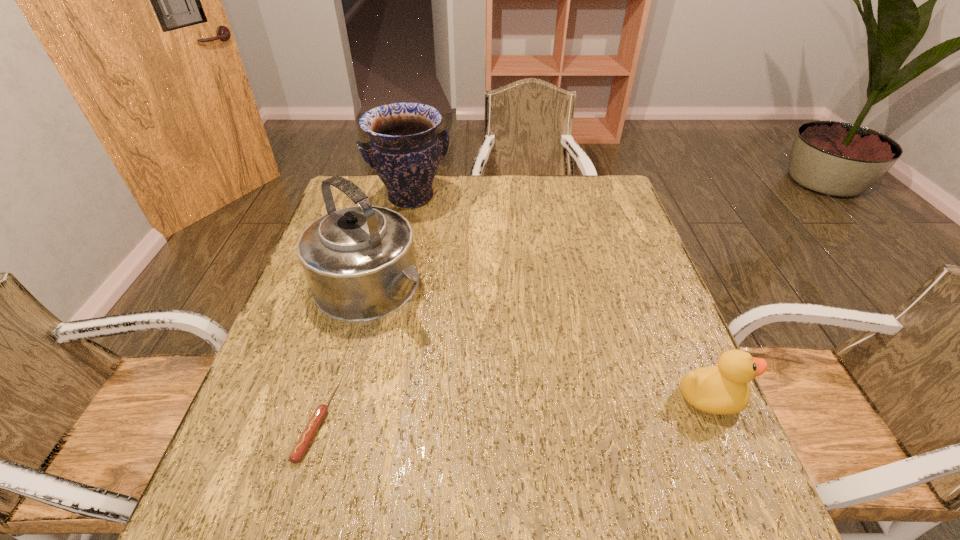
This screenshot has height=540, width=960. In the image, there is a desktop. Find the location of `blank space at the far edge`. blank space at the far edge is located at coordinates (509, 194).

Where is `vacant space at the near edge of the desktop`? vacant space at the near edge of the desktop is located at coordinates (605, 447).

Find the location of a particular element. free space at the left edge of the desktop is located at coordinates (298, 314).

Locate an element on the screen. This screenshot has width=960, height=540. free space at the right edge of the desktop is located at coordinates (613, 319).

In the image, there is a desktop. Where is `blank space at the far left corner`? The height and width of the screenshot is (540, 960). blank space at the far left corner is located at coordinates (373, 178).

The image size is (960, 540). In the image, there is a desktop. Find the location of `vacant space at the near left corner`. vacant space at the near left corner is located at coordinates (238, 428).

You are a GUI agent. You are given a task and a screenshot of the screen. Output one action in this format:
    pyautogui.click(x=<x>, y=<y>)
    Task: Click on the empty space between the second shortest object and the shortest object
    Image resolution: width=960 pixels, height=540 pixels.
    Given the screenshot: What is the action you would take?
    pyautogui.click(x=513, y=410)

Where is `vacant region between the second farthest object and the rightmost object`? The height and width of the screenshot is (540, 960). vacant region between the second farthest object and the rightmost object is located at coordinates (540, 342).

The image size is (960, 540). I want to click on blank region between the second shortest object and the farthest object, so 560,298.

Where is `vacant space that is in between the rightmost object and the sausage`? This screenshot has height=540, width=960. vacant space that is in between the rightmost object and the sausage is located at coordinates (513, 410).